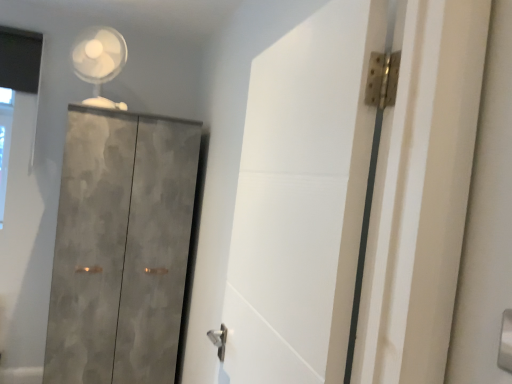
Question: Is white matte door at center situated inside textured concrete cupboard at left or outside?

Choices:
 (A) outside
 (B) inside

Answer: (A)

Question: Is white matte door at center bigger or smaller than textured concrete cupboard at left?

Choices:
 (A) small
 (B) big

Answer: (A)

Question: Which object is the farthest from the white plastic fan at upper left?

Choices:
 (A) textured concrete cupboard at left
 (B) white matte door at center

Answer: (B)

Question: Estimate the real-world distances between objects in this image. Which object is farther from the white matte door at center?

Choices:
 (A) white plastic fan at upper left
 (B) textured concrete cupboard at left

Answer: (A)